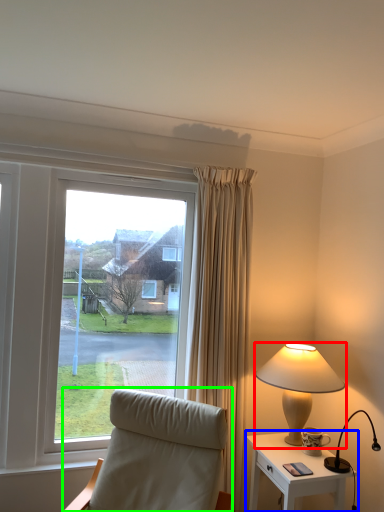
Question: Which object is positioned closest to lamp (highlighted by a red box)? Select from nightstand (highlighted by a blue box) and chair (highlighted by a green box).

Choices:
 (A) nightstand
 (B) chair

Answer: (A)